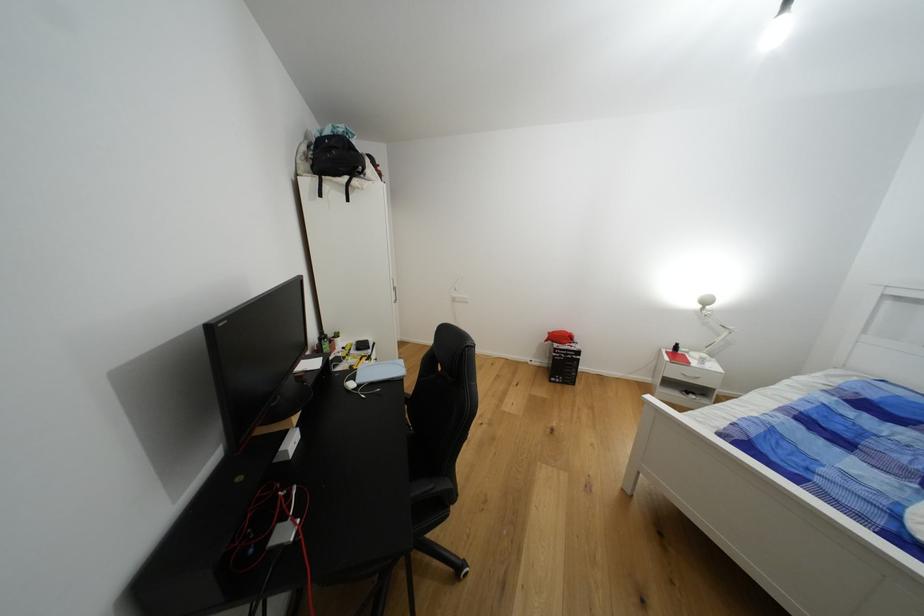
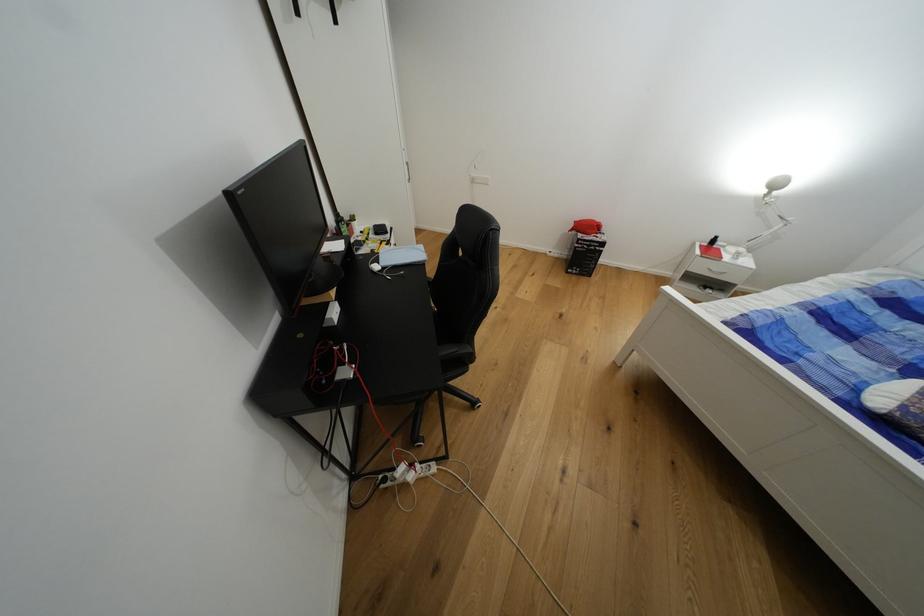
Find the pixel in the second image that matches pixel 552 342 in the first image.

(576, 232)